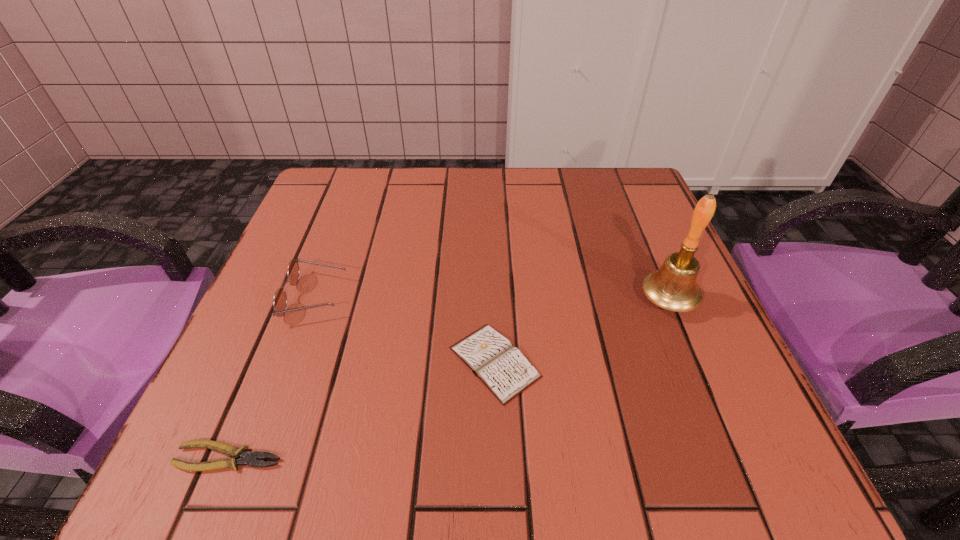
Locate an element on the screen. This screenshot has height=540, width=960. unoccupied area between the pliers and the spectacles is located at coordinates click(273, 377).

You are a GUI agent. You are given a task and a screenshot of the screen. Output one action in this format:
    pyautogui.click(x=<x>, y=<y>)
    Task: Click on the free space between the nearest object and the rightmost object
    The image size is (960, 540).
    Given the screenshot: What is the action you would take?
    pyautogui.click(x=448, y=379)

The image size is (960, 540). I want to click on empty space that is in between the pliers and the spectacles, so click(273, 377).

The height and width of the screenshot is (540, 960). Identify the location of object that is the second closest one to the tallest object. (280, 299).

This screenshot has height=540, width=960. In order to click on the closest object to the third tallest object in this screenshot , I will do `click(673, 287)`.

The image size is (960, 540). I want to click on vacant area that satisfies the following two spatial constraints: 1. on the back side of the pliers; 2. on the right side of the third object from left to right, so click(x=269, y=362).

You are a GUI agent. You are given a task and a screenshot of the screen. Output one action in this format:
    pyautogui.click(x=<x>, y=<y>)
    Task: Click on the vacant space that satisfies the following two spatial constraints: 1. on the front-facing side of the spectacles; 2. on the right side of the second object from right to left
    
    Given the screenshot: What is the action you would take?
    pyautogui.click(x=291, y=362)

The width and height of the screenshot is (960, 540). What are the coordinates of `vacant space that satisfies the following two spatial constraints: 1. on the front-facing side of the bell; 2. on the right side of the third shortest object` in the screenshot? It's located at (314, 300).

Find the location of `blank area in the image that satisfies the following two spatial constraints: 1. on the back side of the rightmost object; 2. on the left side of the shortest object`. blank area in the image that satisfies the following two spatial constraints: 1. on the back side of the rightmost object; 2. on the left side of the shortest object is located at coordinates (294, 300).

At what (x,y) coordinates should I click in order to perform the action: click on free location that satisfies the following two spatial constraints: 1. on the front-facing side of the spectacles; 2. on the left side of the second shortest object. Please return your answer as a coordinate pair (x, y). Looking at the image, I should click on (291, 362).